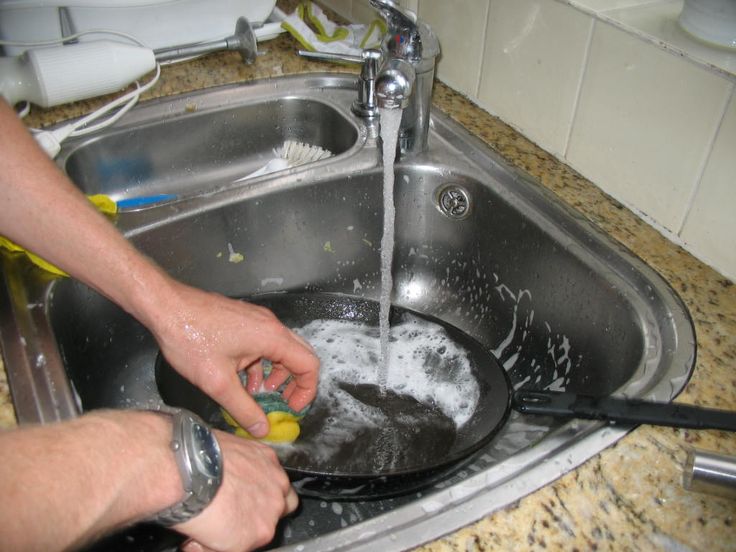
Locate an element on the screen. Image resolution: width=736 pixels, height=552 pixels. caulk is located at coordinates click(x=658, y=226).